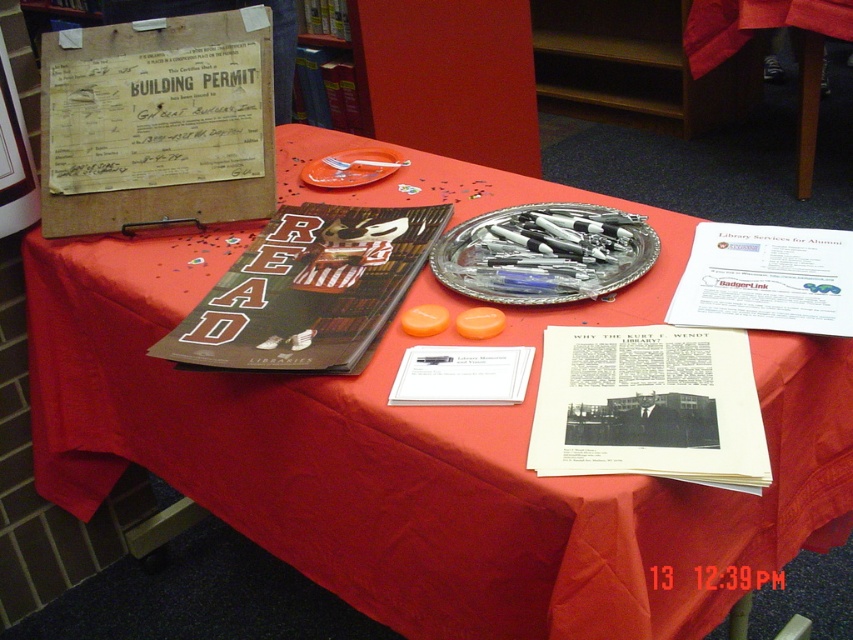
Question: Can you confirm if silver metallic tray at center is smaller than orange plastic plate at center?

Choices:
 (A) no
 (B) yes

Answer: (A)

Question: Which object is farther from the camera taking this photo?

Choices:
 (A) orange plastic plate at center
 (B) silver metallic tray at center

Answer: (A)

Question: Which object is closer to the camera taking this photo?

Choices:
 (A) silver metallic tray at center
 (B) orange plastic plate at center

Answer: (A)

Question: Does silver metallic tray at center appear on the right side of orange plastic plate at center?

Choices:
 (A) no
 (B) yes

Answer: (B)

Question: Can you confirm if silver metallic tray at center is positioned above orange plastic plate at center?

Choices:
 (A) no
 (B) yes

Answer: (A)